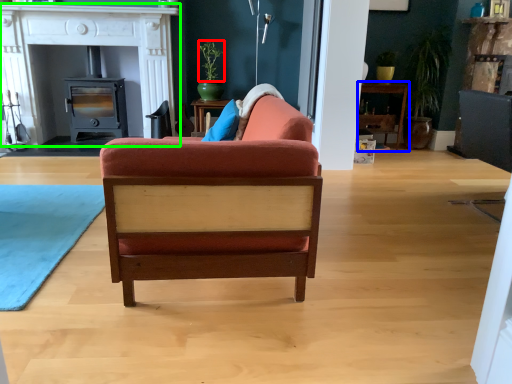
Question: Based on their relative distances, which object is farther from plant (highlighted by a red box)? Choose from table (highlighted by a blue box) and fireplace (highlighted by a green box).

Choices:
 (A) table
 (B) fireplace

Answer: (A)